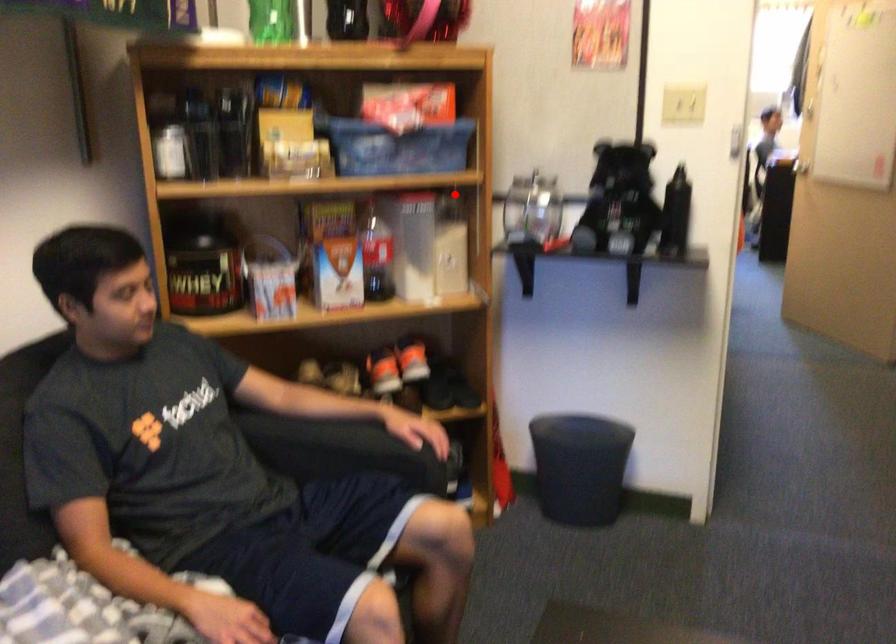
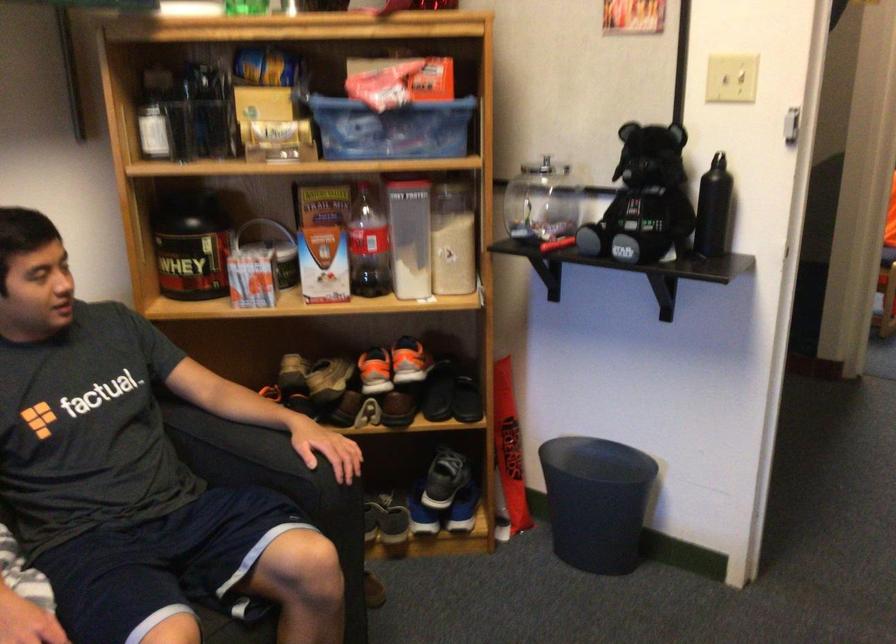
Locate, in the second image, the point that corresponds to the highlighted location in the first image.

(455, 184)